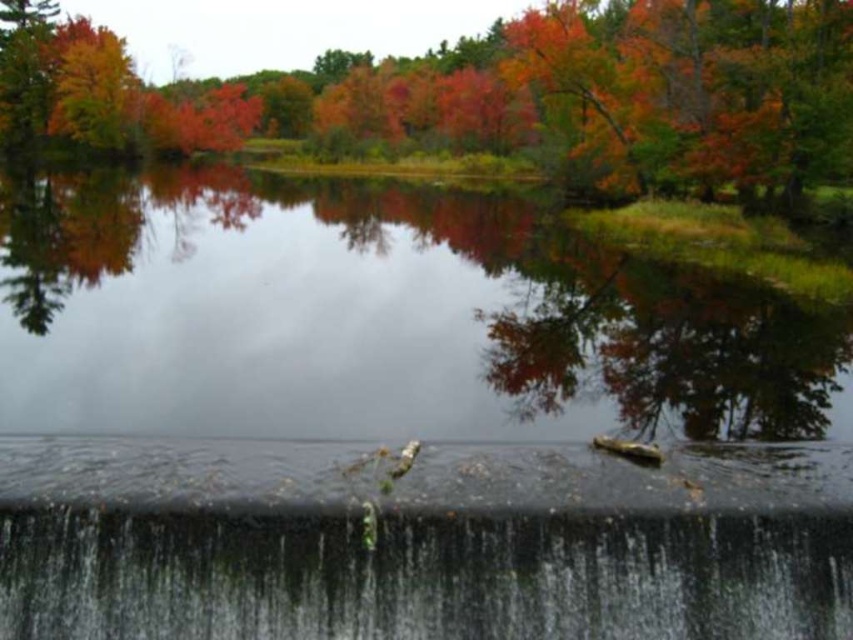
You are standing at the edge of the lake and want to find the autumn leaves at upper center. According to the coordinates provided, where exactly should you look?

The autumn leaves at upper center are located at the coordinates point (x=503, y=97).

You are standing on the dam and see the autumn leaves at upper center and the green mossy concrete waterfall at lower center. Which object is located to the left when facing the waterfall?

The autumn leaves at upper center is positioned on the left side of green mossy concrete waterfall at lower center, so when facing the waterfall, the autumn leaves at upper center would be to the left.